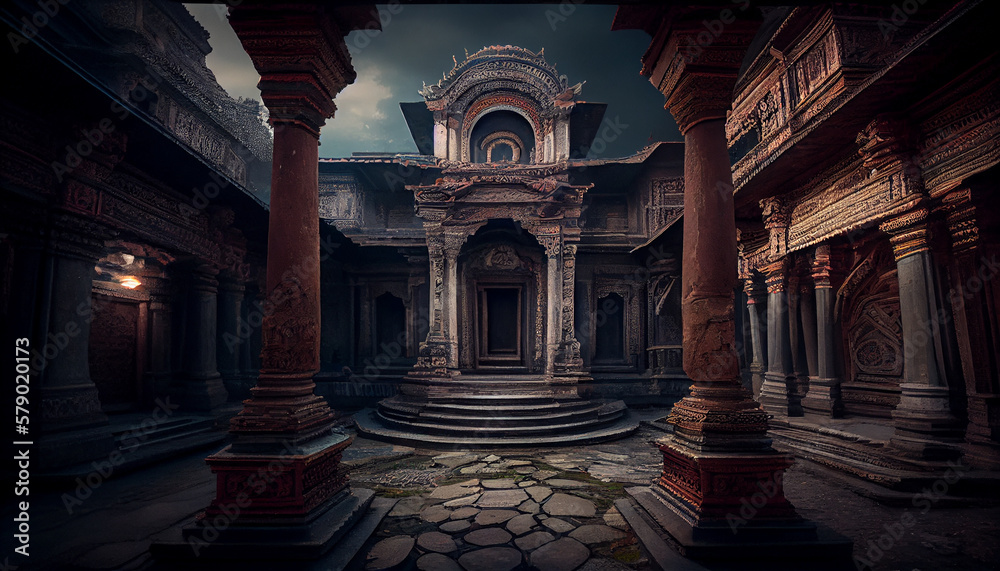
Locate an element on the screen. door on left is located at coordinates (110, 356).